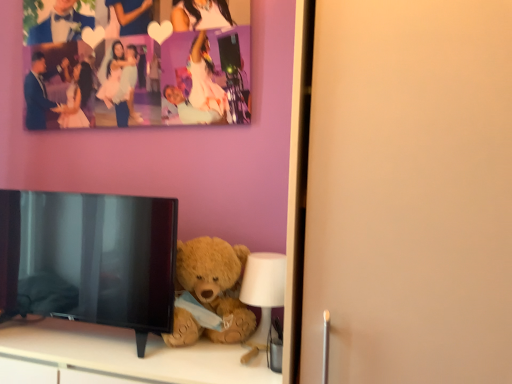
Question: Can you confirm if white plastic lamp at lower center is bigger than soft beige teddy bear at lower center?

Choices:
 (A) yes
 (B) no

Answer: (B)

Question: Is white plastic lamp at lower center further to the viewer compared to soft beige teddy bear at lower center?

Choices:
 (A) no
 (B) yes

Answer: (B)

Question: From a real-world perspective, is white plastic lamp at lower center physically below soft beige teddy bear at lower center?

Choices:
 (A) no
 (B) yes

Answer: (A)

Question: Is white plastic lamp at lower center wider than soft beige teddy bear at lower center?

Choices:
 (A) yes
 (B) no

Answer: (B)

Question: From a real-world perspective, is white plastic lamp at lower center positioned over soft beige teddy bear at lower center based on gravity?

Choices:
 (A) no
 (B) yes

Answer: (B)

Question: Is soft beige teddy bear at lower center wider or thinner than white plastic lamp at lower center?

Choices:
 (A) wide
 (B) thin

Answer: (A)

Question: From a real-world perspective, is soft beige teddy bear at lower center above or below white plastic lamp at lower center?

Choices:
 (A) below
 (B) above

Answer: (A)

Question: Is soft beige teddy bear at lower center inside the boundaries of white plastic lamp at lower center, or outside?

Choices:
 (A) outside
 (B) inside

Answer: (A)

Question: Is point (227, 372) positioned closer to the camera than point (283, 291)?

Choices:
 (A) closer
 (B) farther

Answer: (A)

Question: Based on their positions, is fuzzy brown teddy bear at lower center located to the left or right of soft beige teddy bear at lower center?

Choices:
 (A) right
 (B) left

Answer: (A)

Question: Is fuzzy brown teddy bear at lower center spatially inside soft beige teddy bear at lower center, or outside of it?

Choices:
 (A) inside
 (B) outside

Answer: (B)

Question: In the image, is fuzzy brown teddy bear at lower center positioned in front of or behind soft beige teddy bear at lower center?

Choices:
 (A) front
 (B) behind

Answer: (B)

Question: Is fuzzy brown teddy bear at lower center wider or thinner than soft beige teddy bear at lower center?

Choices:
 (A) thin
 (B) wide

Answer: (A)

Question: Considering the positions of fuzzy brown teddy bear at lower center and black glossy tv at lower left in the image, is fuzzy brown teddy bear at lower center bigger or smaller than black glossy tv at lower left?

Choices:
 (A) big
 (B) small

Answer: (B)

Question: Is fuzzy brown teddy bear at lower center in front of or behind black glossy tv at lower left in the image?

Choices:
 (A) behind
 (B) front

Answer: (A)